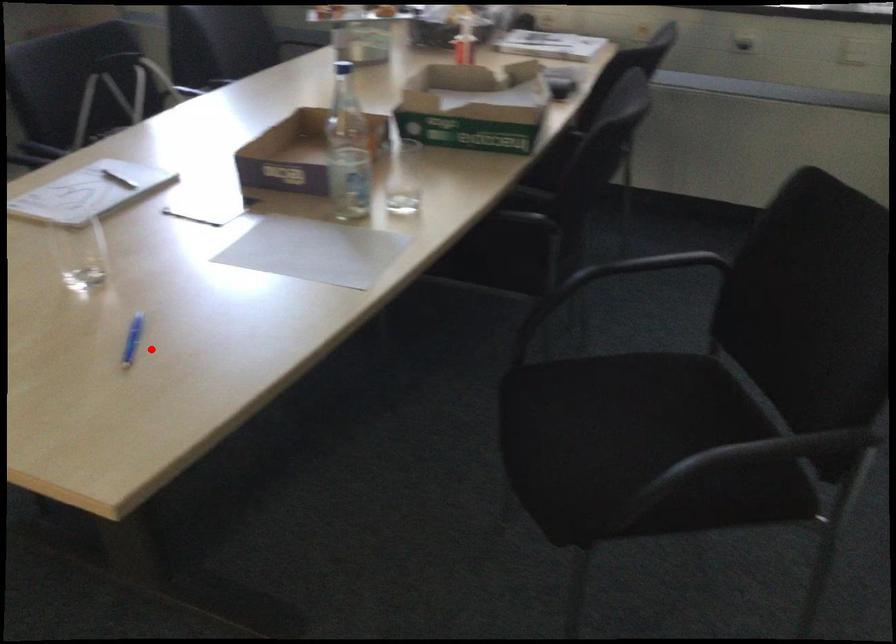
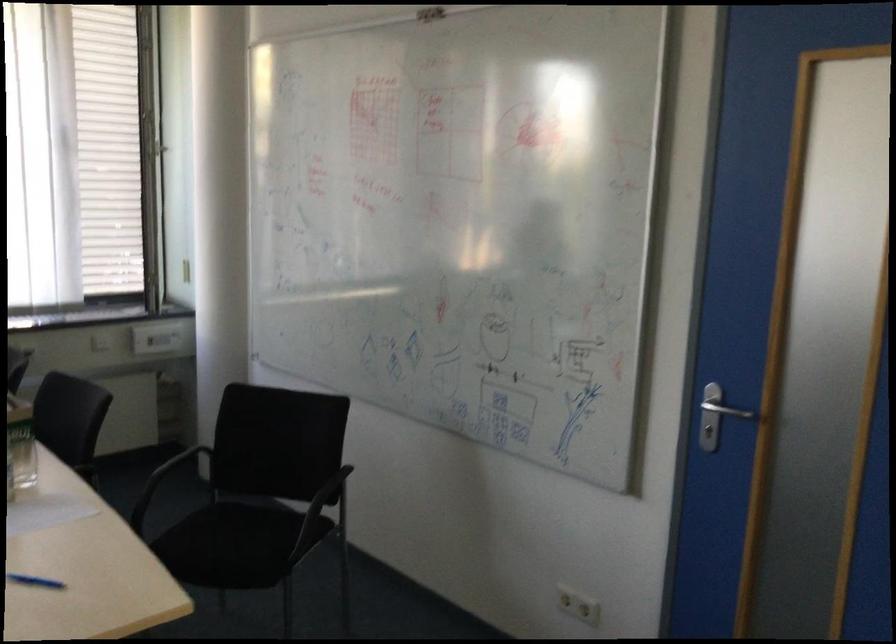
Question: I am providing you with two images of the same scene from different viewpoints. In image1, a red point is highlighted. Considering the same 3D point in image2, which of the following is correct?

Choices:
 (A) It is closer
 (B) It is farther

Answer: (B)